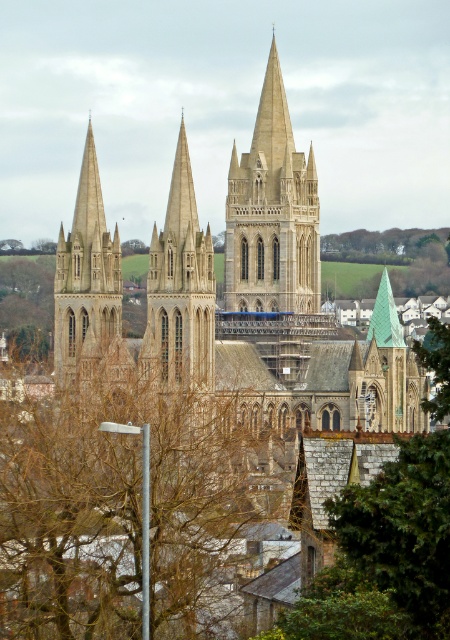
You are standing in front of the cathedral and notice a point marked at coordinates (x=180, y=289). Based on the scene description, which architectural feature is this point most likely located on?

The point at (x=180, y=289) is on the beige stone tower at center, which is the central spire of the cathedral.

You are a photographer planning to capture the cathedral with both the brown leafless tree at center and the beige stone tower at center in the frame. Based on their sizes, which object should you focus on to ensure both fit in the photo without cropping?

The brown leafless tree at center has a larger width than the beige stone tower at center, so focusing on the tree would allow both to fit in the frame without cropping.

You are standing in front of the cathedral and want to take a photo that includes both the beige stone tower at center and the green leafy tree at upper center. Which object should you position closer to the front of your camera frame to ensure both are in focus?

You should position the beige stone tower at center closer to the front of your camera frame because it is closer to the viewer than the green leafy tree at upper center, ensuring both objects are in focus.